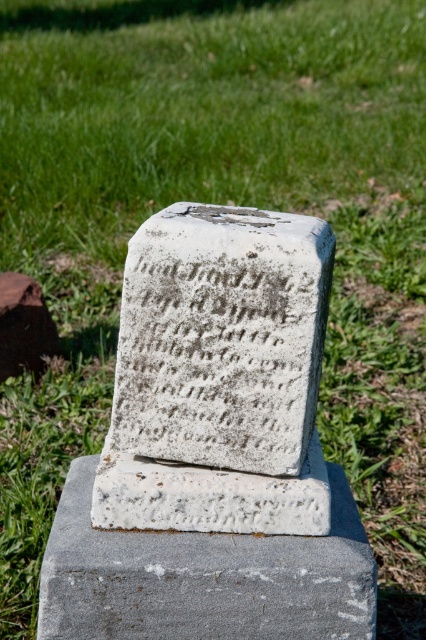
The image size is (426, 640). I want to click on white stone gravestone at center, so click(x=218, y=376).

This screenshot has height=640, width=426. What do you see at coordinates (218, 376) in the screenshot?
I see `white stone gravestone at center` at bounding box center [218, 376].

This screenshot has height=640, width=426. I want to click on white stone gravestone at center, so click(x=218, y=376).

Is white stone gravestone at center shorter than white stone inscription at center?

No.

Does white stone gravestone at center appear on the right side of white stone inscription at center?

Correct, you'll find white stone gravestone at center to the right of white stone inscription at center.

Who is more forward, (164, 364) or (262, 296)?

Point (262, 296) is more forward.

Find the location of a particular element. white stone gravestone at center is located at coordinates (218, 376).

Between white stone inscription at center and gray concrete at center, which one is positioned higher?

white stone inscription at center is above.

Does point (241, 358) come behind point (48, 573)?

Yes.

Is point (115, 428) positioned behind point (245, 547)?

Yes, point (115, 428) is behind point (245, 547).

This screenshot has height=640, width=426. Identify the location of white stone inscription at center. (215, 360).